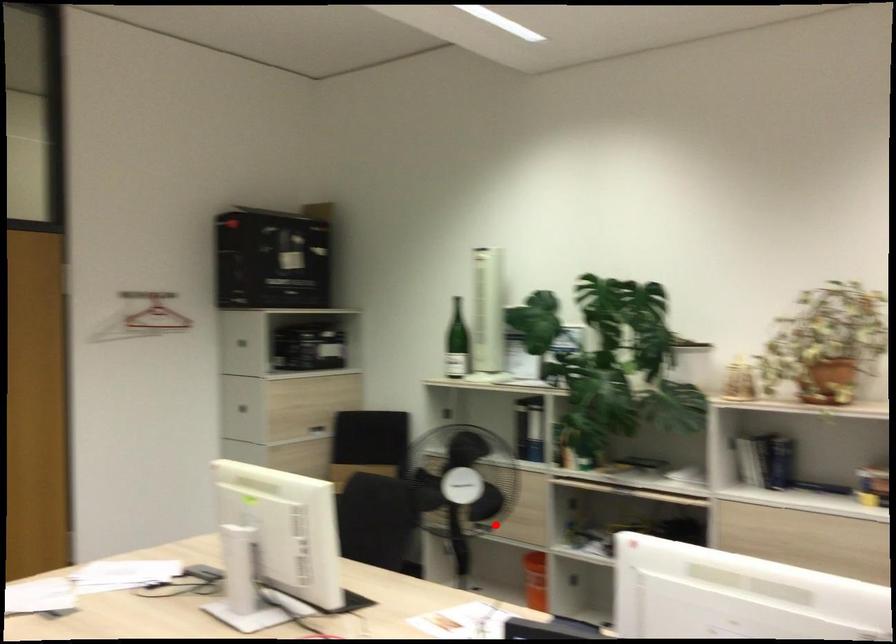
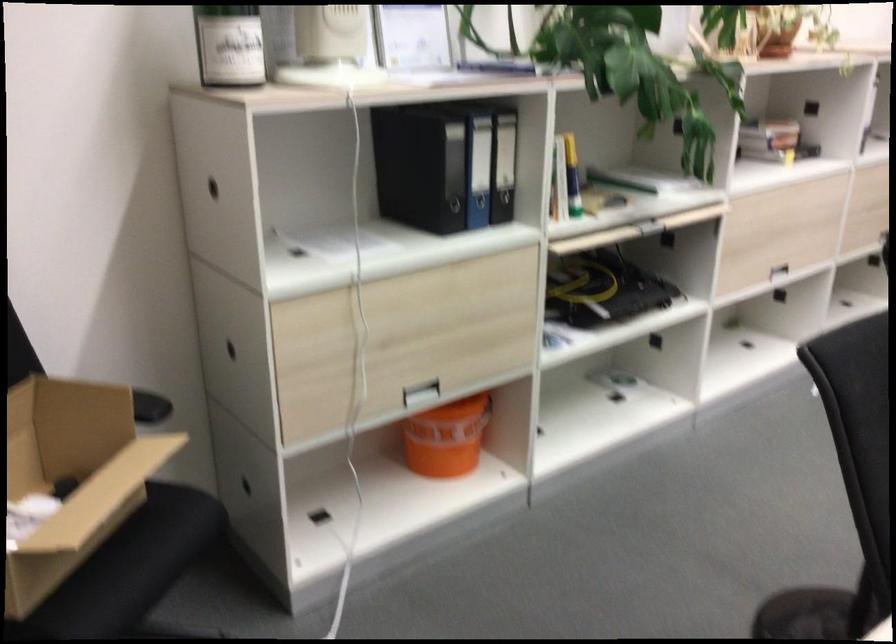
Question: I am providing you with two images of the same scene from different viewpoints. A red point is marked on the first image. Can you still see the location of the red point in image 2?

Choices:
 (A) Yes
 (B) No

Answer: (A)